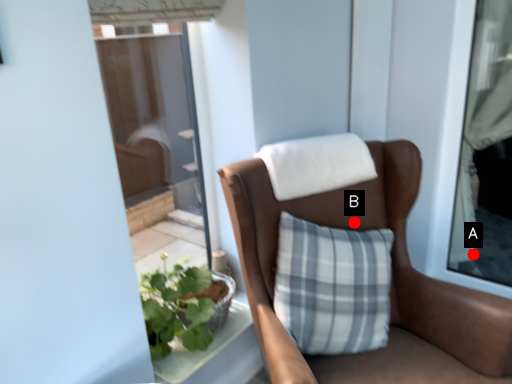
Question: Two points are circled on the image, labeled by A and B beside each circle. Which point appears farthest from the camera in this image?

Choices:
 (A) A is further
 (B) B is further

Answer: (A)